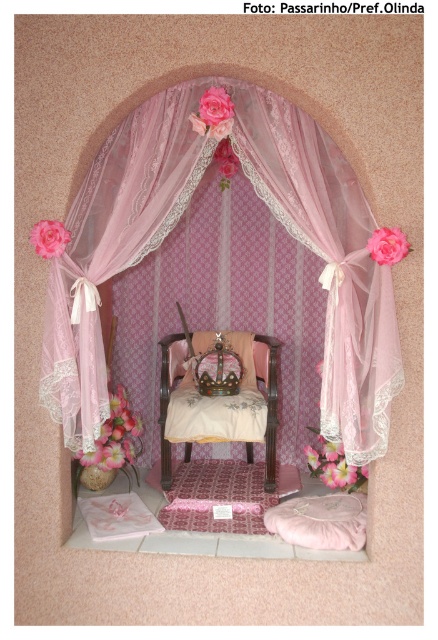
You are an interior designer planning to place a new decorative item in the throne room scene. The pink fabric flower at lower center is currently at point (x=334, y=465). Where should you place it to avoid overlapping with the existing canopy and throne?

The pink fabric flower at lower center should be placed at a different coordinate to avoid overlapping with the existing canopy and throne. Since its current position is at point (x=334, y=465), moving it slightly to the left or right while keeping it near the lower center area would help maintain the aesthetic while avoiding overlap.

You are a royal gardener tasked with arranging flowers in the throne room. You have two flowers to place on the canopy. The matte pink rose at center and the pink fabric flower at upper center. Which flower is shorter?

The matte pink rose at center is shorter than the pink fabric flower at upper center.

Looking at this image, you are an interior designer planning to add a new decoration to the throne room scene. You have a golden statue that you want to place between the pink fabric flower at upper center and the pink lace flower at center. Based on their positions, where should you position the statue to ensure it is between them?

The pink fabric flower at upper center is in front of the pink lace flower at center, so placing the golden statue between them would require positioning it in front of the pink lace flower at center but behind the pink fabric flower at upper center. However, since the fabric flower is already in front, the statue should be placed directly between them along the depth axis, ensuring it is in front of the lace flower but behind the fabric flower.